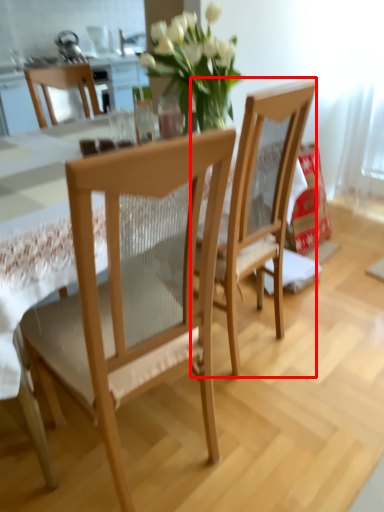
Question: In this image, where is chair (annotated by the red box) located relative to chair?

Choices:
 (A) right
 (B) left

Answer: (A)